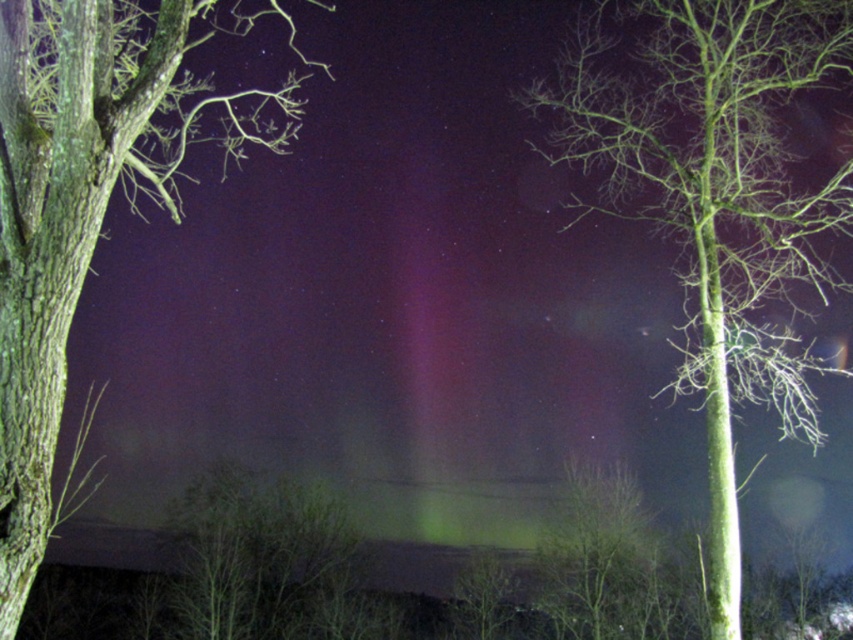
This screenshot has height=640, width=853. Describe the element at coordinates (85, 202) in the screenshot. I see `smooth bark tree at left` at that location.

Which of these two, smooth bark tree at left or green matte tree at right, stands shorter?

green matte tree at right

You are a GUI agent. You are given a task and a screenshot of the screen. Output one action in this format:
    pyautogui.click(x=<x>, y=<y>)
    Task: Click on the smooth bark tree at left
    This screenshot has height=640, width=853.
    Given the screenshot: What is the action you would take?
    pyautogui.click(x=85, y=202)

Identify the location of smooth bark tree at left. coord(85,202).

Can you confirm if green matte tree at center is positioned to the left of smooth bark tree at left?

No, green matte tree at center is not to the left of smooth bark tree at left.

What do you see at coordinates (715, 198) in the screenshot?
I see `green matte tree at center` at bounding box center [715, 198].

The image size is (853, 640). What are the coordinates of `green matte tree at center` in the screenshot? It's located at (715, 198).

What do you see at coordinates (715, 198) in the screenshot? This screenshot has width=853, height=640. I see `green matte tree at center` at bounding box center [715, 198].

The height and width of the screenshot is (640, 853). Find the location of `green matte tree at center`. green matte tree at center is located at coordinates (715, 198).